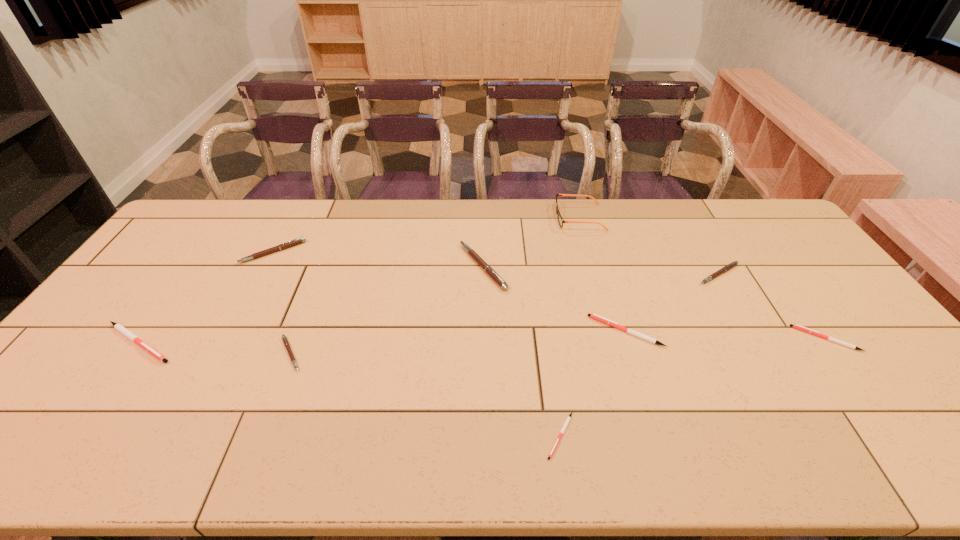
Locate an element on the screen. The height and width of the screenshot is (540, 960). the third smallest white pen is located at coordinates (614, 324).

At what (x,y) coordinates should I click in order to perform the action: click on the second white pen from right to left. Please return your answer as a coordinate pair (x, y). Image resolution: width=960 pixels, height=540 pixels. Looking at the image, I should click on (614, 324).

Where is `the sixth pen from right to left`? the sixth pen from right to left is located at coordinates (286, 343).

Where is `the second pink pen from left to right`? the second pink pen from left to right is located at coordinates (286, 343).

Image resolution: width=960 pixels, height=540 pixels. I want to click on the rightmost pen, so (x=796, y=326).

The image size is (960, 540). Identify the location of the rightmost white pen. (796, 326).

The image size is (960, 540). Identify the location of the shortest object. (569, 417).

Where is `the fifth pen from left to right`? This screenshot has width=960, height=540. the fifth pen from left to right is located at coordinates (569, 417).

Find the location of a particular element. Image resolution: width=960 pixels, height=540 pixels. vacant area located 0.070m on the front-facing side of the black spectacles is located at coordinates [536, 217].

Where is `free region located 0.350m on the front-facing side of the black spectacles`? free region located 0.350m on the front-facing side of the black spectacles is located at coordinates click(460, 217).